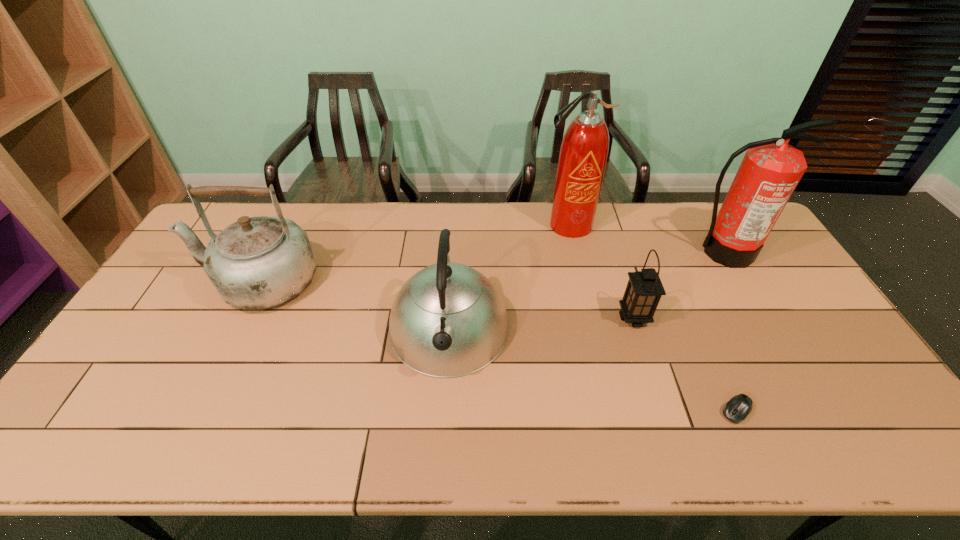
Identify the location of the left fire extinguisher. (584, 150).

This screenshot has width=960, height=540. Identify the location of the rightmost object. (771, 169).

Where is `the leftmost object`? This screenshot has width=960, height=540. the leftmost object is located at coordinates (260, 262).

Identify the location of the third tallest object. (260, 262).

I want to click on the second object from left to right, so click(x=448, y=320).

Locate an element on the screen. The height and width of the screenshot is (540, 960). the third shortest object is located at coordinates (448, 320).

This screenshot has width=960, height=540. In order to click on lantern in this screenshot , I will do `click(644, 289)`.

Locate an element on the screen. The image size is (960, 540). the second object from right to left is located at coordinates (738, 408).

Identify the location of mouse. Image resolution: width=960 pixels, height=540 pixels. (738, 408).

Where is `free location located 0.090m on the right of the left fire extinguisher`? free location located 0.090m on the right of the left fire extinguisher is located at coordinates click(x=620, y=225).